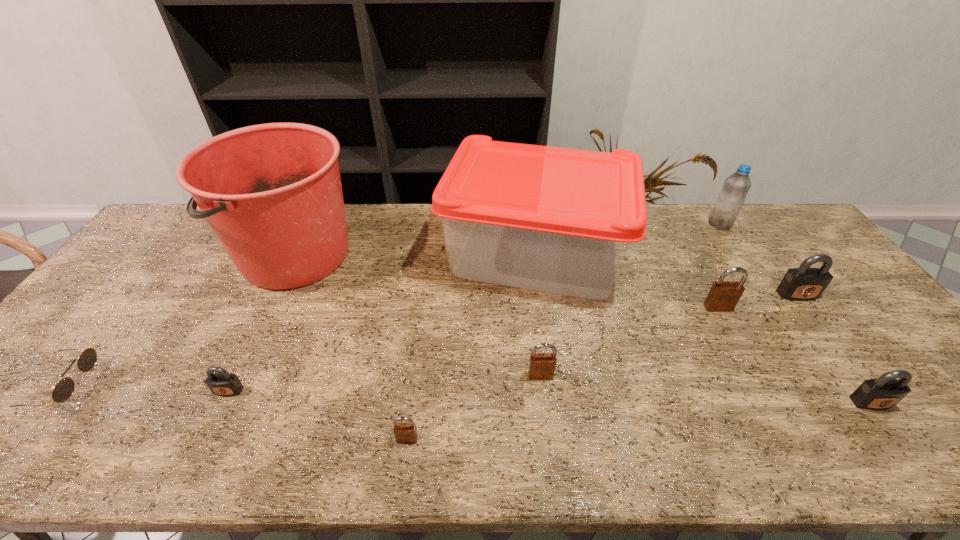
The image size is (960, 540). Identify the location of the third farthest padlock. click(x=542, y=366).

Find the location of a particular element. the second smallest brown padlock is located at coordinates (542, 366).

Where is `the second smallest gray padlock`? The width and height of the screenshot is (960, 540). the second smallest gray padlock is located at coordinates (x=882, y=393).

Find the location of a particular element. the leftmost padlock is located at coordinates (221, 383).

Find the location of a particular element. This screenshot has width=960, height=540. the leftmost gray padlock is located at coordinates (221, 383).

The height and width of the screenshot is (540, 960). I want to click on the nearest object, so click(405, 433).

Where is `the smallest brown padlock`? Image resolution: width=960 pixels, height=540 pixels. the smallest brown padlock is located at coordinates (405, 433).

At what (x,y) coordinates should I click in order to perform the action: click on the shortest object. Please return your answer as a coordinate pair (x, y). This screenshot has width=960, height=540. Looking at the image, I should click on pos(63,390).

Locate an element on the screen. the leftmost object is located at coordinates (63, 390).

The width and height of the screenshot is (960, 540). In order to click on vacant space positioned 0.400m on the front of the bucket in this screenshot , I will do `click(208, 439)`.